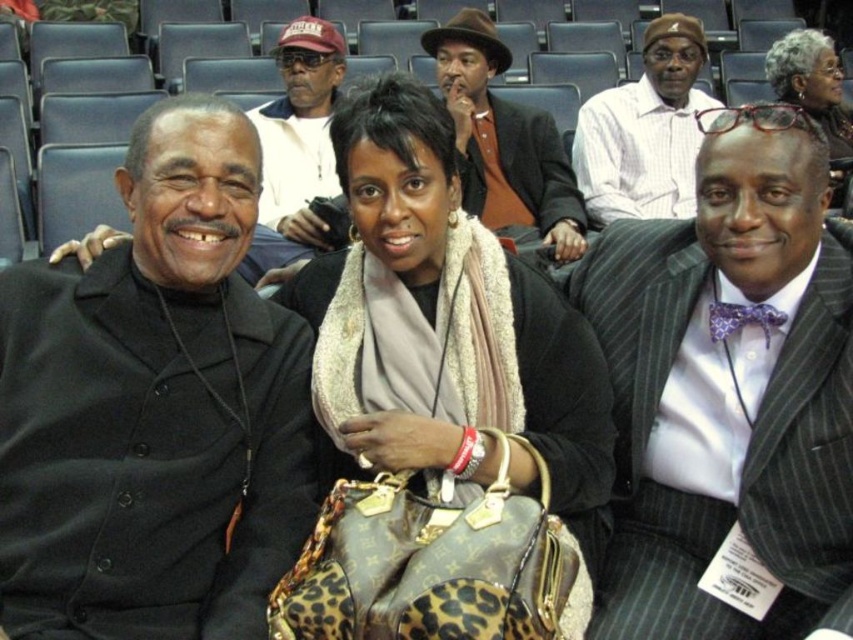
You are a photographer trying to capture a clear shot of the two men in the scene. The black matte suit at left and the matte black jacket at center. Which one is positioned lower in the frame?

The black matte suit at left is positioned lower in the frame because it is below the matte black jacket at center according to the description.

You are standing at the origin point in the auditorium and want to walk towards the point at coordinates point [683,44]. However, there is an obstacle at point [277,220]. Will you encounter this obstacle before reaching your destination?

Point [683,44] is behind point [277,220], so yes, you will encounter the obstacle at point [277,220] before reaching your destination.

Based on the photo, based on the scene description, which object is positioned to the right of the other between the matte black jacket at center and the matte black hair at center?

The matte black hair at center is positioned to the right of the matte black jacket at center.